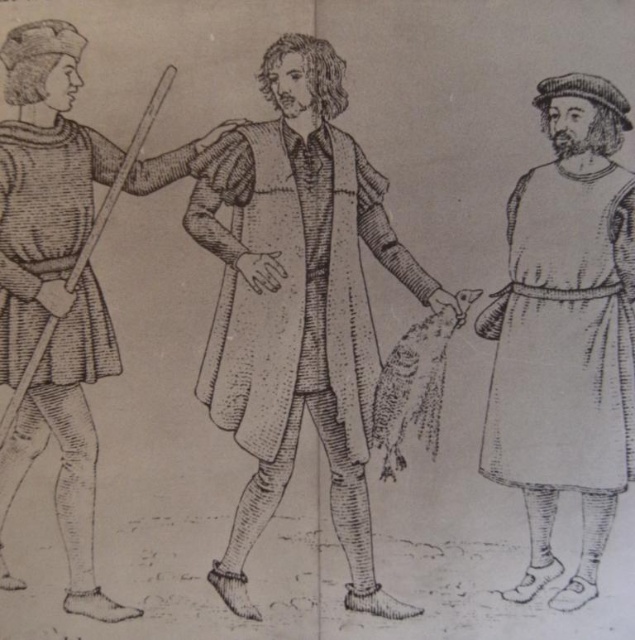
Between smooth brown coat at center and smooth beige tunic at right, which one has less height?

Standing shorter between the two is smooth beige tunic at right.

Between smooth brown coat at center and smooth beige tunic at right, which one appears on the right side from the viewer's perspective?

smooth beige tunic at right

Who is more forward, (x=276, y=320) or (x=552, y=400)?

Point (x=552, y=400) is in front.

The width and height of the screenshot is (635, 640). I want to click on smooth brown coat at center, so click(x=298, y=307).

What do you see at coordinates (565, 333) in the screenshot? I see `smooth beige tunic at right` at bounding box center [565, 333].

Image resolution: width=635 pixels, height=640 pixels. I want to click on smooth beige tunic at right, so click(565, 333).

What do you see at coordinates (565, 333) in the screenshot? I see `smooth beige tunic at right` at bounding box center [565, 333].

Locate an element on the screen. The height and width of the screenshot is (640, 635). smooth beige tunic at right is located at coordinates (565, 333).

Is smooth brown coat at center bigger than smooth brown robe at center?

Incorrect, smooth brown coat at center is not larger than smooth brown robe at center.

In the scene shown: Can you confirm if smooth brown coat at center is thinner than smooth brown robe at center?

No, smooth brown coat at center is not thinner than smooth brown robe at center.

I want to click on smooth brown coat at center, so click(298, 307).